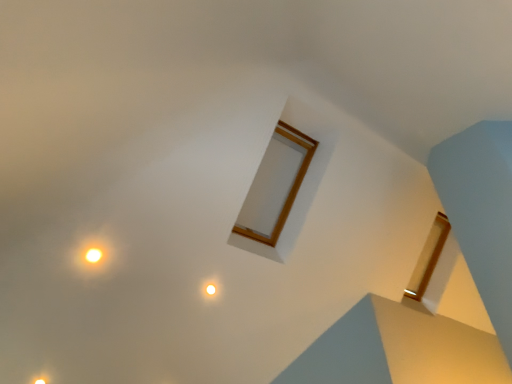
Question: Considering the positions of point (211, 284) and point (88, 261), is point (211, 284) closer or farther from the camera than point (88, 261)?

Choices:
 (A) farther
 (B) closer

Answer: (A)

Question: From the image's perspective, is matte white light at center, the 1th light viewed from the back, above or below yellow matte light at upper left, the second light viewed from the right?

Choices:
 (A) below
 (B) above

Answer: (A)

Question: Considering the real-world distances, which object is farthest from the matte white light at center, the third light positioned from the left?

Choices:
 (A) yellow matte light at upper left, acting as the 1th light starting from the top
 (B) matte yellow light at lower left, which appears as the second light when viewed from the back

Answer: (B)

Question: Which of these objects is positioned closest to the yellow matte light at upper left, the second light positioned from the left?

Choices:
 (A) matte yellow light at lower left, which appears as the second light when viewed from the front
 (B) matte white light at center, the third light positioned from the left

Answer: (B)